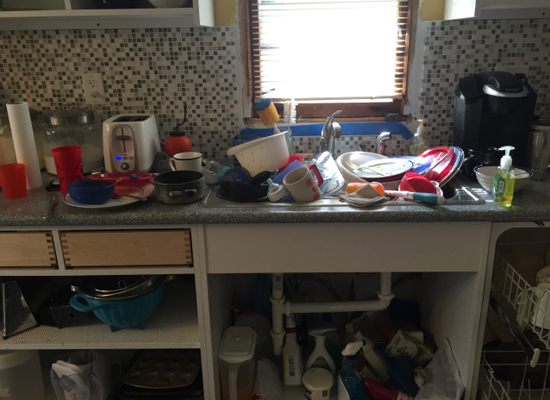
The width and height of the screenshot is (550, 400). I want to click on soap, so click(x=504, y=168), click(x=417, y=144).